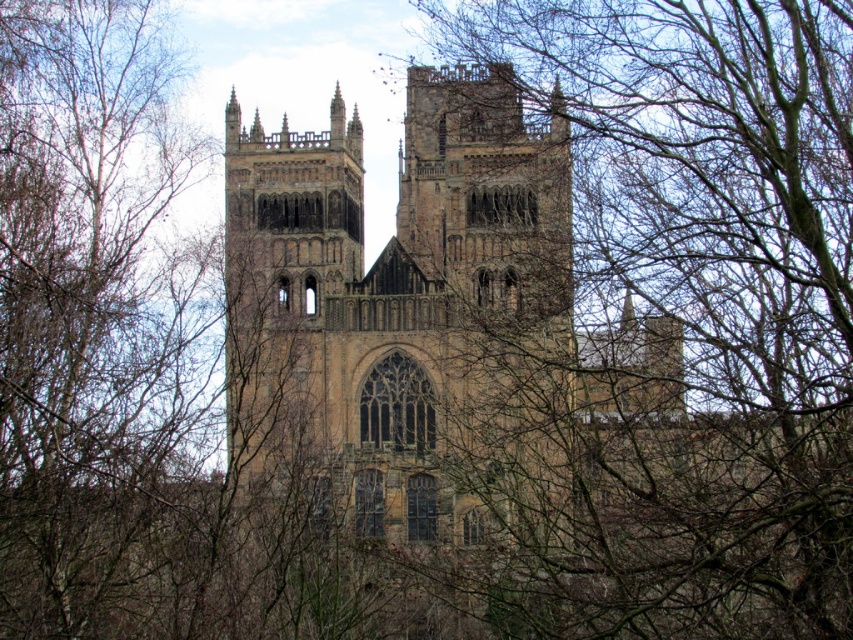
You are an architect analyzing the cathedral. You notice the brown leafless branches at upper center and the brown stone church at center. Which object occupies a greater area in the image?

The brown leafless branches at upper center is larger in size than the brown stone church at center, so it occupies a greater area in the image.